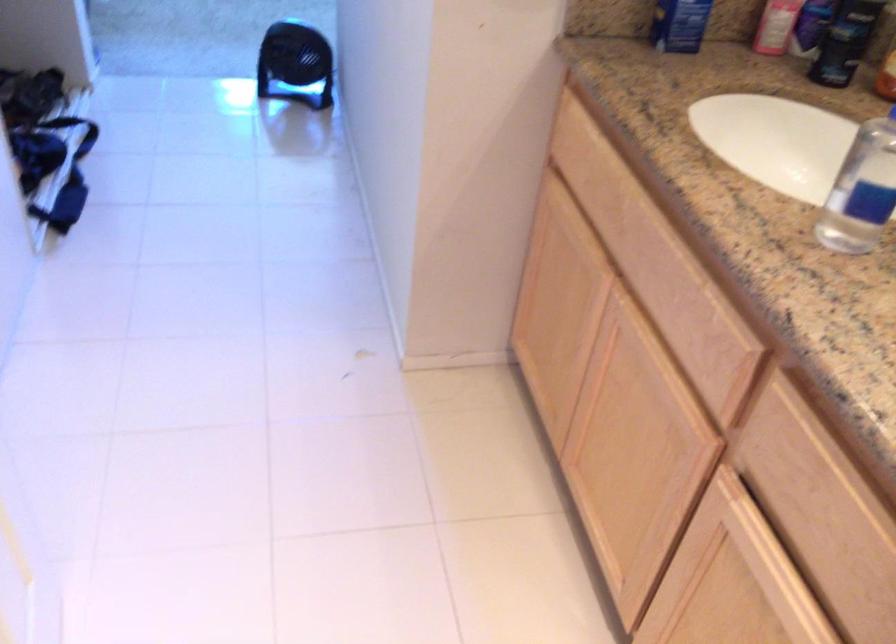
Identify the location of black bottle. The image size is (896, 644). (845, 41).